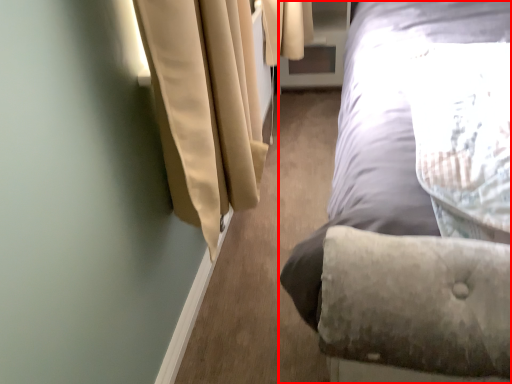
Question: From the image's perspective, what is the correct spatial relationship of bed (annotated by the red box) in relation to screen door?

Choices:
 (A) above
 (B) below

Answer: (B)